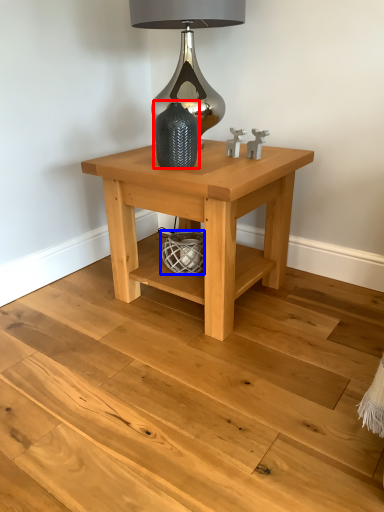
Question: Which object is further to the camera taking this photo, vase (highlighted by a red box) or basket (highlighted by a blue box)?

Choices:
 (A) vase
 (B) basket

Answer: (B)